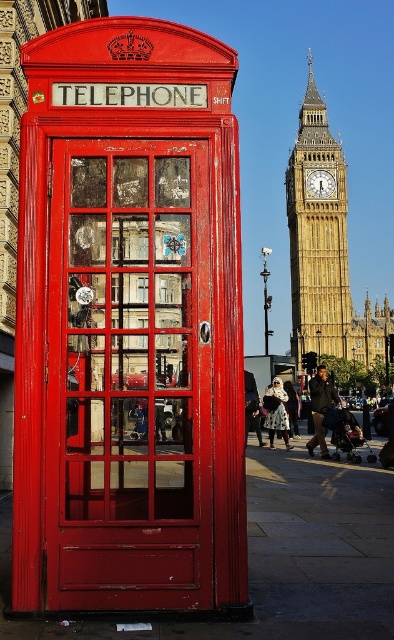
Which is above, matte red telephone box at center or yellow stone clock tower at upper center?

yellow stone clock tower at upper center is above.

Who is positioned more to the right, matte red telephone box at center or yellow stone clock tower at upper center?

Positioned to the right is yellow stone clock tower at upper center.

You are a GUI agent. You are given a task and a screenshot of the screen. Output one action in this format:
    pyautogui.click(x=<x>, y=<y>)
    Task: Click on the matte red telephone box at center
    This screenshot has height=640, width=394.
    Given the screenshot: What is the action you would take?
    pyautogui.click(x=128, y=324)